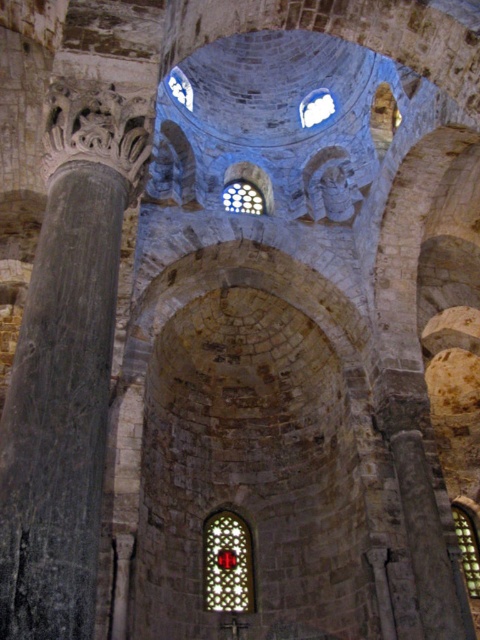
You are an architect planning to install a new lighting system in the cathedral. You need to place a spotlight that has a maximum reach of 50 meters. Can the spotlight placed at the black stone column at left illuminate the clear glass window at center?

The distance between the black stone column at left and the clear glass window at center is 56.40 meters, which exceeds the spotlight maximum reach of 50 meters. Therefore, the spotlight cannot illuminate the clear glass window at center from the black stone column at left.

You are an architect visiting this historical site. You need to determine the spatial relationship between the stained glass window at center and the transparent glass window at upper center. Which one is taller?

The stained glass window at center is shorter than the transparent glass window at upper center, so the transparent glass window at upper center is taller.